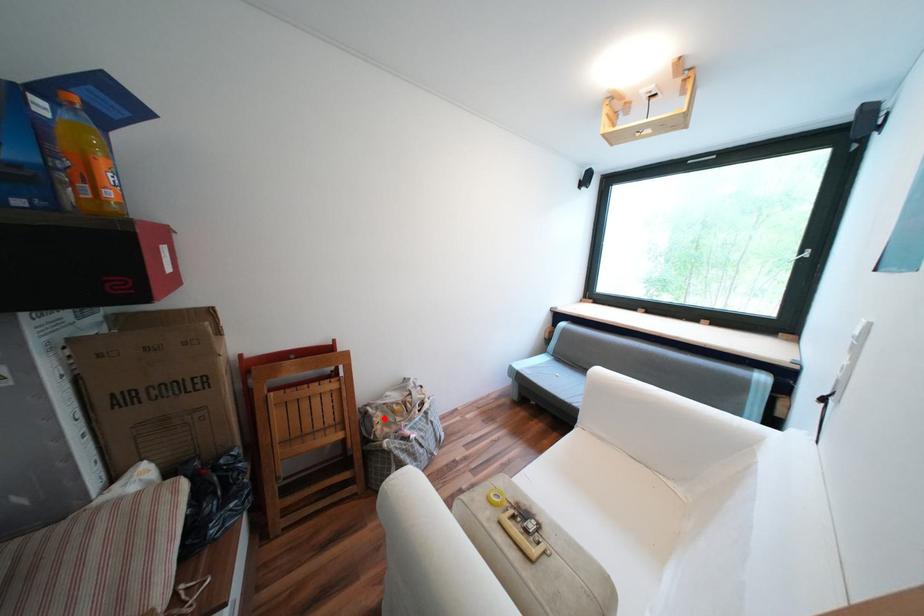
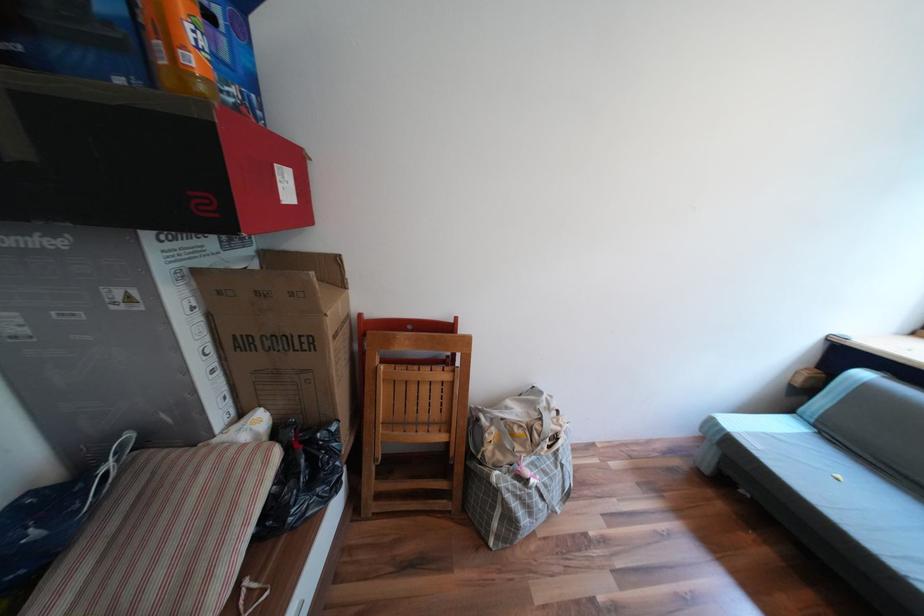
Find the pixel in the second image that matches the highlighted location in the first image.

(495, 435)